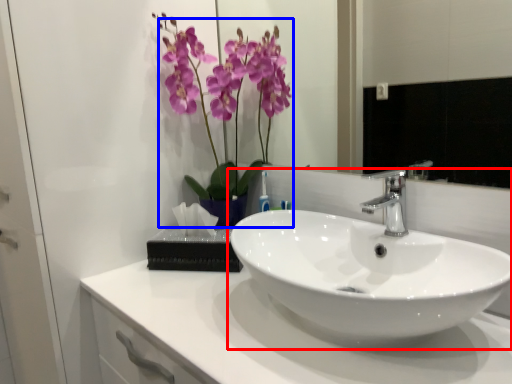
Question: Which point is further to the camera, sink (highlighted by a red box) or floral arrangement (highlighted by a blue box)?

Choices:
 (A) sink
 (B) floral arrangement

Answer: (B)